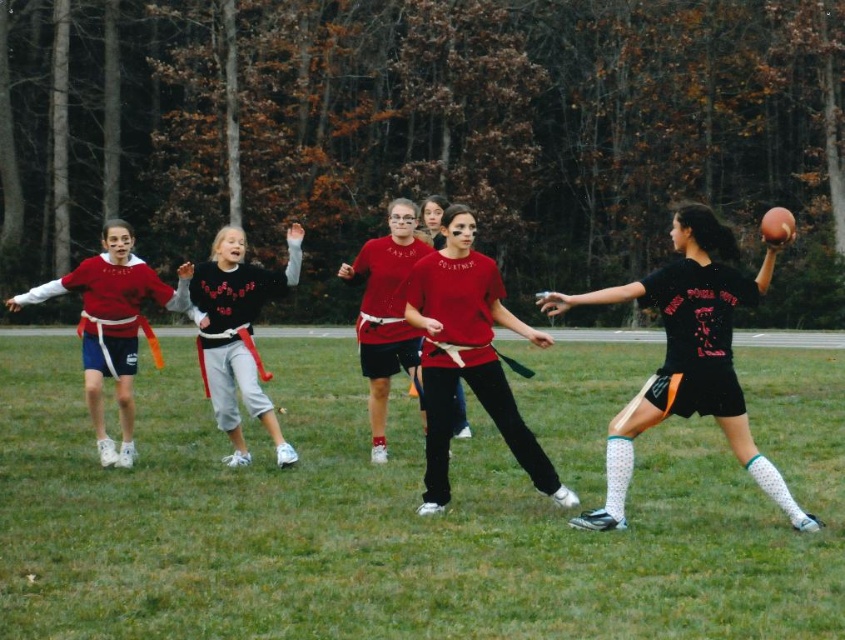
You are a spectator at the flag football game. You see the green grass football field at center and the black matte jersey at right. Which object is closer to the ground?

The green grass football field at center is positioned under the black matte jersey at right, so it is closer to the ground.

You are a photographer standing at the edge of the green grass football field at center. You want to take a picture of the matte red jersey at left without any obstructions. Since the field is wider than the jersey, where should you position yourself to ensure the jersey fits entirely within the frame?

The green grass football field at center is wider than the matte red jersey at left. To capture the matte red jersey at left fully in the frame, position yourself at the edge of the field facing towards the jersey, ensuring the camera angle includes the entire jersey without any part being cut off by the field edges.